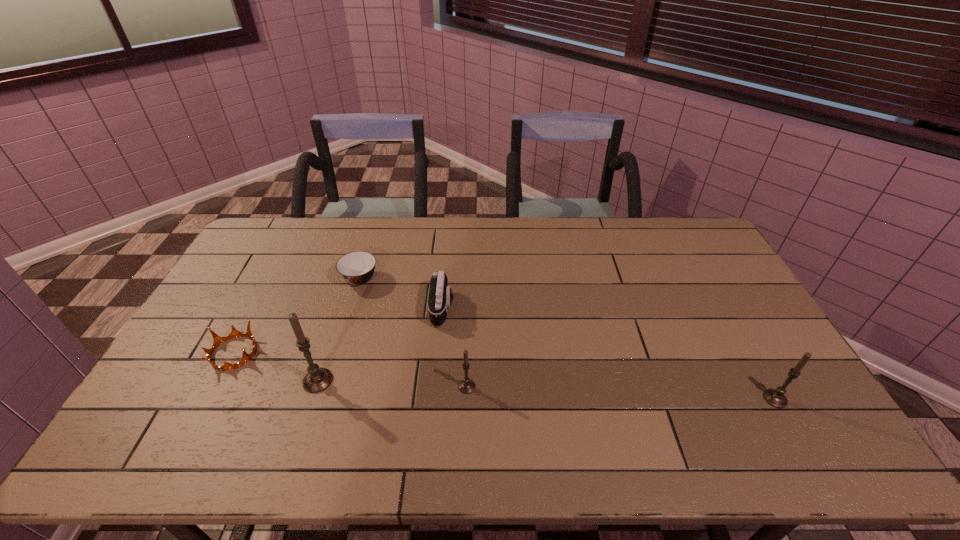
I want to click on blank area located on the right of the leftmost candle, so click(396, 381).

Where is `vacant region located 0.360m on the back of the second candle from right to left`? Image resolution: width=960 pixels, height=540 pixels. vacant region located 0.360m on the back of the second candle from right to left is located at coordinates (469, 288).

Where is `vacant space located 0.120m on the left of the second tallest candle`? Image resolution: width=960 pixels, height=540 pixels. vacant space located 0.120m on the left of the second tallest candle is located at coordinates (718, 399).

I want to click on vacant space located 0.160m on the left of the soup bowl, so click(294, 279).

In order to click on free spot located on the left of the leftmost object in this screenshot , I will do 193,353.

At what (x,y) coordinates should I click in order to perform the action: click on vacant space located on the front lens of the third object from right to left. Please return your answer as a coordinate pair (x, y). Looking at the image, I should click on (515, 308).

The width and height of the screenshot is (960, 540). I want to click on object that is positioned at the left edge, so click(218, 340).

The image size is (960, 540). Identify the location of object that is at the right edge. (776, 398).

This screenshot has width=960, height=540. Find the location of `object present at the near right corner`. object present at the near right corner is located at coordinates (776, 398).

At what (x,y) coordinates should I click in order to perform the action: click on vacant area at the far edge of the desktop. Please return your answer as a coordinate pair (x, y). Looking at the image, I should click on (579, 219).